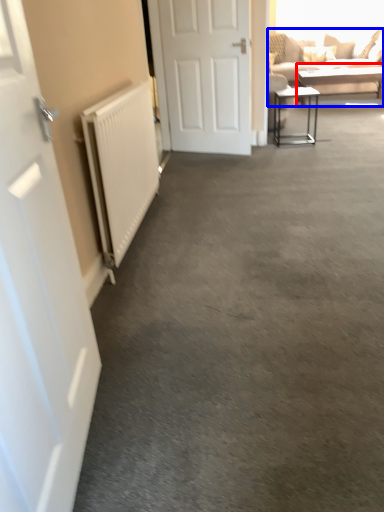
Question: Which object appears closest to the camera in this image, table (highlighted by a red box) or studio couch (highlighted by a blue box)?

Choices:
 (A) table
 (B) studio couch

Answer: (B)